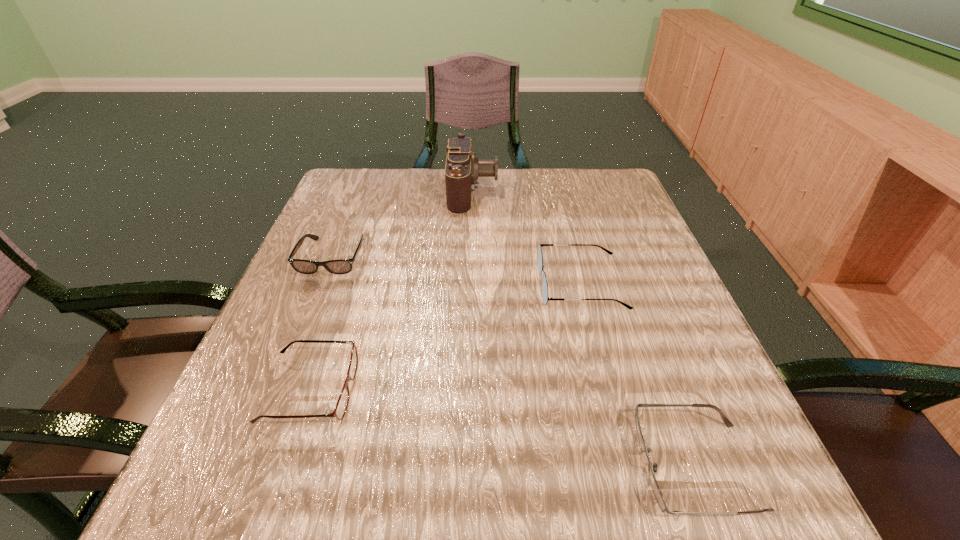
I want to click on the tallest object, so click(463, 168).

At what (x,y) coordinates should I click in order to perform the action: click on camera. Please return your answer as a coordinate pair (x, y). This screenshot has height=540, width=960. Looking at the image, I should click on (463, 168).

At what (x,y) coordinates should I click in order to perform the action: click on free point located 0.080m on the front-facing side of the third object from left to right. Please return your answer as a coordinate pair (x, y). Looking at the image, I should click on (530, 191).

Locate an element on the screen. The image size is (960, 540). object present at the far edge is located at coordinates (463, 168).

Find the location of a particular element. The height and width of the screenshot is (540, 960). object that is at the near edge is located at coordinates (657, 492).

You are a GUI agent. You are given a task and a screenshot of the screen. Output one action in this format:
    pyautogui.click(x=<x>, y=<y>)
    Task: Click on the object that is at the near right corner
    The height and width of the screenshot is (540, 960).
    Given the screenshot: What is the action you would take?
    pyautogui.click(x=657, y=492)

You are a GUI agent. You are given a task and a screenshot of the screen. Output one action in this format:
    pyautogui.click(x=<x>, y=<y>)
    Task: Click on the free space at the far edge of the desktop
    The height and width of the screenshot is (540, 960).
    Given the screenshot: What is the action you would take?
    point(530,182)

Find the location of a particular element. The width and height of the screenshot is (960, 540). vacant region at the near edge of the desktop is located at coordinates (584, 502).

The width and height of the screenshot is (960, 540). Find the location of `vacant space at the left edge of the desktop`. vacant space at the left edge of the desktop is located at coordinates (348, 232).

In the image, there is a desktop. Where is `vacant space at the right edge`? Image resolution: width=960 pixels, height=540 pixels. vacant space at the right edge is located at coordinates click(x=660, y=288).